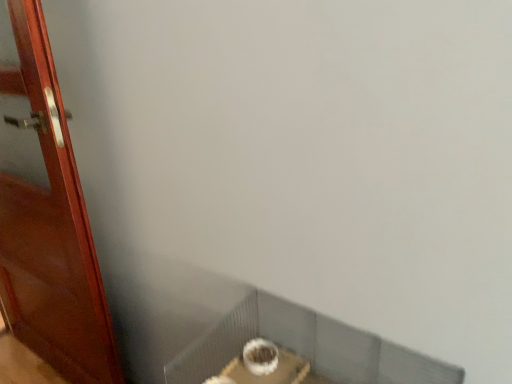
This screenshot has height=384, width=512. What do you see at coordinates (306, 347) in the screenshot?
I see `white textured tile at upper center` at bounding box center [306, 347].

Identify the location of white textured tile at upper center. (306, 347).

Describe the element at coordinates (51, 228) in the screenshot. I see `wooden door at left` at that location.

Measure the distance between point [49,204] and camera.

They are 4.38 feet apart.

At what (x,y) coordinates should I click in order to perform the action: click on wooden door at left. Please return your answer as a coordinate pair (x, y). The width and height of the screenshot is (512, 384). Looking at the image, I should click on (51, 228).

Locate an element on the screen. The image size is (512, 384). white textured tile at upper center is located at coordinates (306, 347).

Is wooden door at left at the right side of white textured tile at upper center?

In fact, wooden door at left is to the left of white textured tile at upper center.

Which is in front, wooden door at left or white textured tile at upper center?

white textured tile at upper center.

Considering the points (88, 305) and (276, 319), which point is in front, point (88, 305) or point (276, 319)?

Positioned in front is point (276, 319).

From the image's perspective, is wooden door at left under white textured tile at upper center?

No.

From a real-world perspective, is wooden door at left over white textured tile at upper center?

Yes, from a real-world perspective, wooden door at left is over white textured tile at upper center

Is wooden door at left wider than white textured tile at upper center?

No.

From their relative heights in the image, would you say wooden door at left is taller or shorter than white textured tile at upper center?

In the image, wooden door at left appears to be taller than white textured tile at upper center.

Considering the sizes of objects wooden door at left and white textured tile at upper center in the image provided, who is smaller, wooden door at left or white textured tile at upper center?

white textured tile at upper center.

Is wooden door at left outside of white textured tile at upper center?

Indeed, wooden door at left is completely outside white textured tile at upper center.

Is wooden door at left not close to white textured tile at upper center?

No, wooden door at left is not far from white textured tile at upper center.

Is wooden door at left oriented away from white textured tile at upper center?

No.

How different are the orientations of wooden door at left and white textured tile at upper center in degrees?

The angle between the facing direction of wooden door at left and the facing direction of white textured tile at upper center is 1.28 degrees.

How distant is wooden door at left from white textured tile at upper center?

wooden door at left is 29.05 inches from white textured tile at upper center.

Where is `window sill below the wooden door at left (from a real-world perspective)`? The height and width of the screenshot is (384, 512). window sill below the wooden door at left (from a real-world perspective) is located at coordinates (306, 347).

Does white textured tile at upper center appear on the right side of wooden door at left?

Indeed, white textured tile at upper center is positioned on the right side of wooden door at left.

Considering their positions, is white textured tile at upper center located in front of or behind wooden door at left?

white textured tile at upper center is positioned closer to the viewer than wooden door at left.

Which is closer, (199, 358) or (55, 175)?

The point (199, 358) is closer.

From the image's perspective, is white textured tile at upper center on wooden door at left?

No, from the image's perspective, white textured tile at upper center is not over wooden door at left.

From a real-world perspective, which is physically below, white textured tile at upper center or wooden door at left?

white textured tile at upper center, from a real-world perspective.

Which object is thinner, white textured tile at upper center or wooden door at left?

wooden door at left is thinner.

Who is shorter, white textured tile at upper center or wooden door at left?

white textured tile at upper center.

Considering the sizes of objects white textured tile at upper center and wooden door at left in the image provided, who is bigger, white textured tile at upper center or wooden door at left?

Bigger between the two is wooden door at left.

Is white textured tile at upper center not within wooden door at left?

Indeed, white textured tile at upper center is completely outside wooden door at left.

Are white textured tile at upper center and wooden door at left beside each other?

white textured tile at upper center is not next to wooden door at left, and they're not touching.

From the picture: Could you tell me if white textured tile at upper center is facing wooden door at left?

No.

Identify the location of window sill below the wooden door at left (from a real-world perspective). The image size is (512, 384). (306, 347).

At what (x,y) coordinates should I click in order to perform the action: click on door that appears behind the white textured tile at upper center. Please return your answer as a coordinate pair (x, y). This screenshot has height=384, width=512. Looking at the image, I should click on (51, 228).

Find the location of a particular element. The height and width of the screenshot is (384, 512). window sill in front of the wooden door at left is located at coordinates (306, 347).